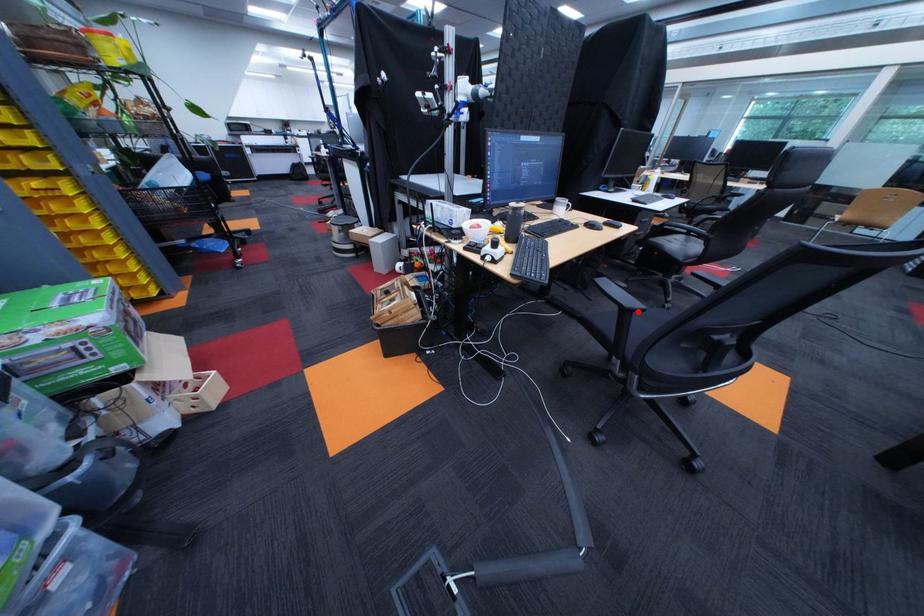
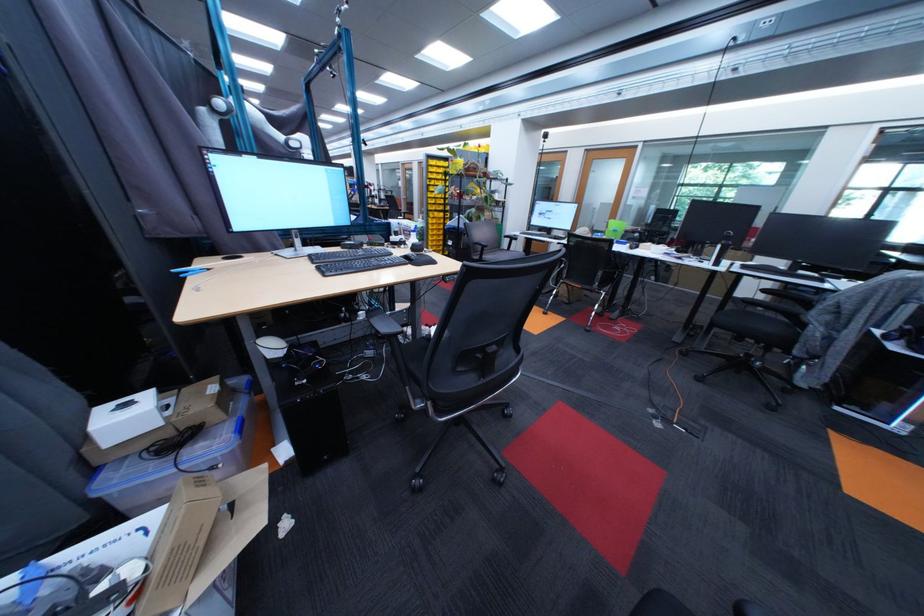
Question: I am providing you with two images of the same scene from different viewpoints. A red point is marked on the first image. At the location where the point appears in image 1, is it still visible in image 2?

Choices:
 (A) Yes
 (B) No

Answer: (B)